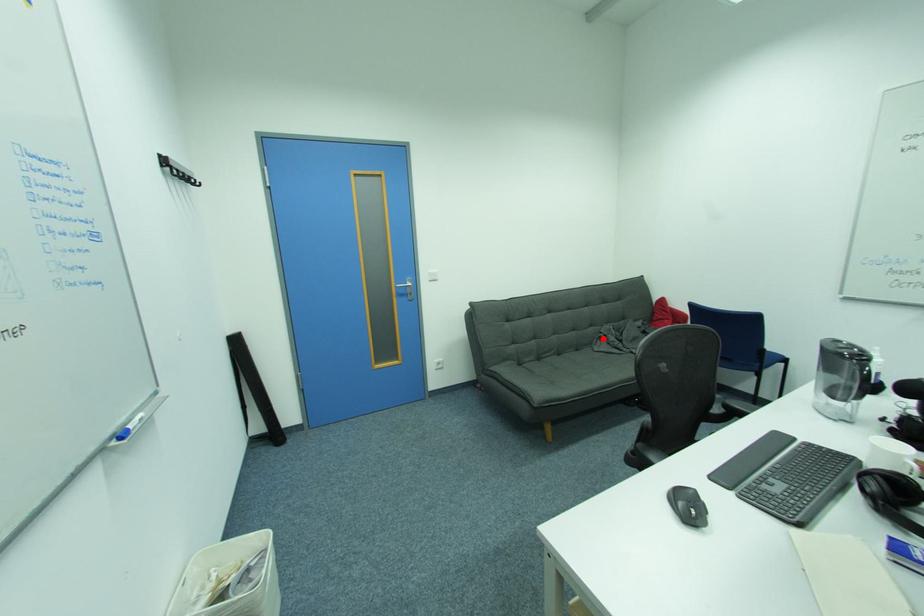
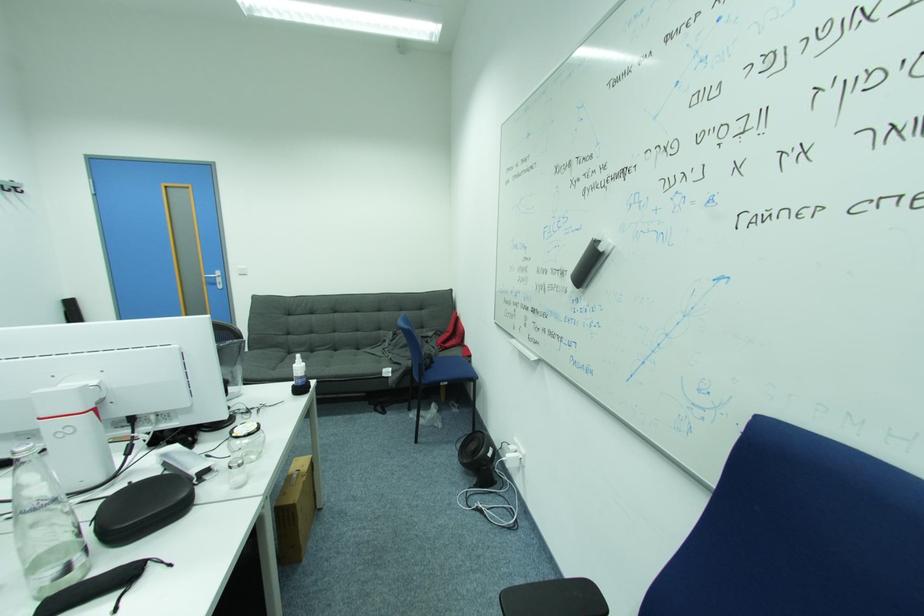
Question: I am providing you with two images of the same scene from different viewpoints. A red point is shown in image1. For the corresponding object point in image2, is it positioned nearer or farther from the camera?

Choices:
 (A) Nearer
 (B) Farther

Answer: (B)